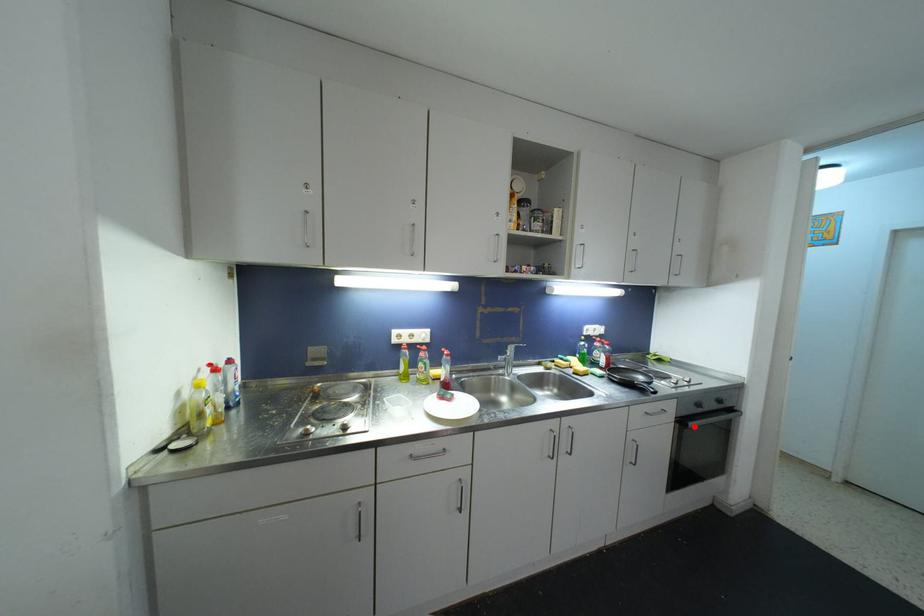
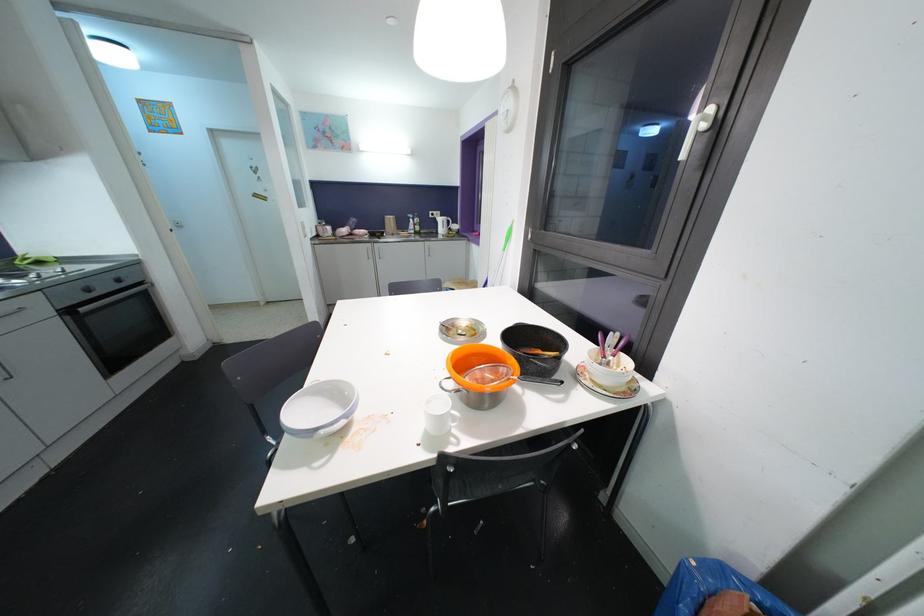
In the second image, find the point that corresponds to the highlighted location in the first image.

(84, 312)